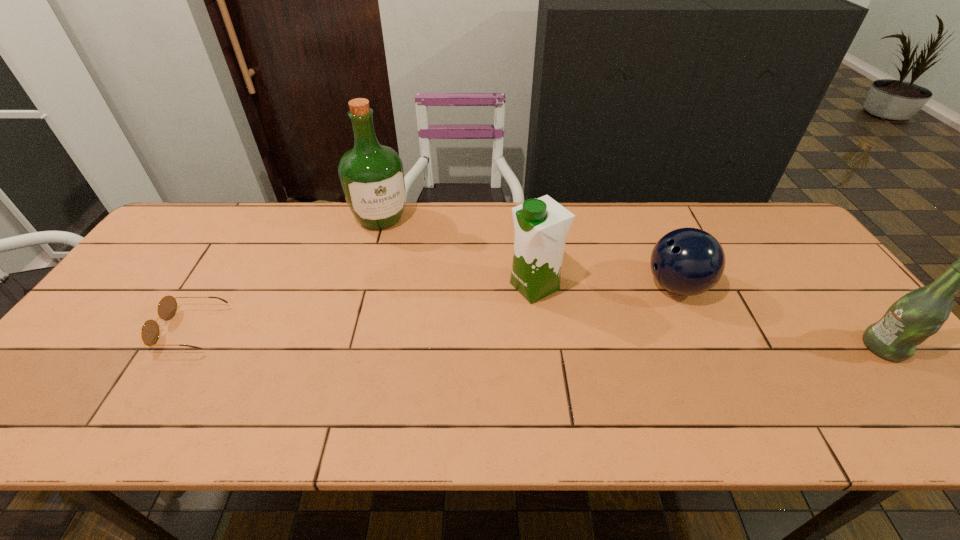
You are a GUI agent. You are given a task and a screenshot of the screen. Output one action in this format:
    pyautogui.click(x=<x>, y=<y>)
    Task: Click on the vacant spot on the desktop that is between the sunglasses and the rightmost object and is positioned on the surface of the second object from right to left near the finger holes
    The height and width of the screenshot is (540, 960).
    Given the screenshot: What is the action you would take?
    (573, 339)

Locate an element on the screen. The width and height of the screenshot is (960, 540). free spot on the desktop that is between the sunglasses and the beer bottle and is positioned on the front-facing side of the third object from left to right is located at coordinates point(434,335).

Locate an element on the screen. The image size is (960, 540). free space on the desktop that is between the sunglasses and the rightmost object and is positioned on the front-facing side of the second object from left to right is located at coordinates (441, 335).